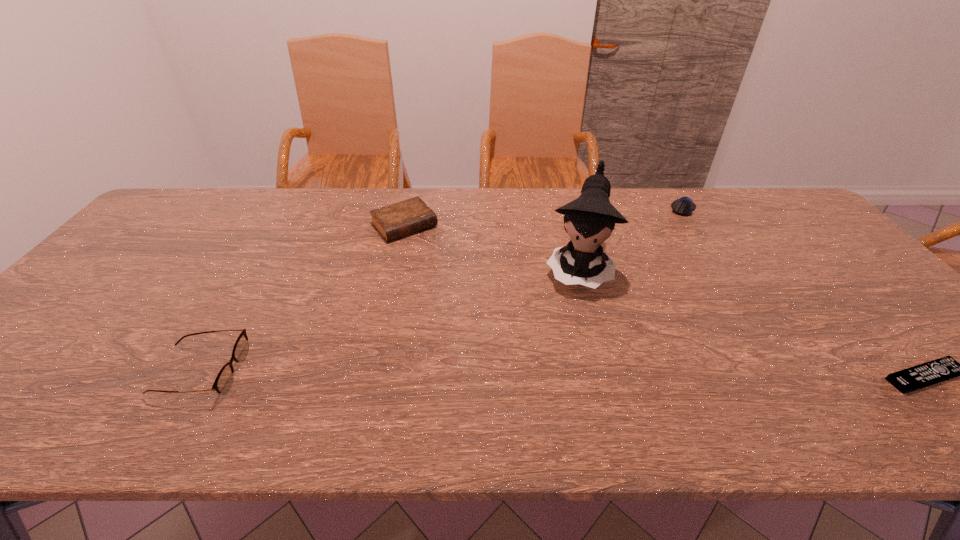
This screenshot has width=960, height=540. Identify the location of object that is at the near edge. (x=224, y=380).

This screenshot has width=960, height=540. In order to click on free space at the far edge of the desktop in this screenshot , I will do [x=699, y=192].

This screenshot has height=540, width=960. Identify the location of free space at the near edge of the desktop. (553, 375).

Image resolution: width=960 pixels, height=540 pixels. What are the coordinates of `vacant space at the left edge` in the screenshot? It's located at (151, 231).

What are the coordinates of `vacant region at the right edge of the desktop` in the screenshot? It's located at [868, 341].

The height and width of the screenshot is (540, 960). Find the location of `free space at the far left corner`. free space at the far left corner is located at coordinates (172, 203).

I want to click on free space at the far right corner, so click(793, 214).

Find the location of a particular element. blank region between the leftmost object and the tallest object is located at coordinates point(389,321).

Image resolution: width=960 pixels, height=540 pixels. Identify the location of vacant point located between the fourth tallest object and the third shortest object. (543, 217).

The width and height of the screenshot is (960, 540). Find the location of `object that can be found as the third closest to the spectacles`. object that can be found as the third closest to the spectacles is located at coordinates (684, 206).